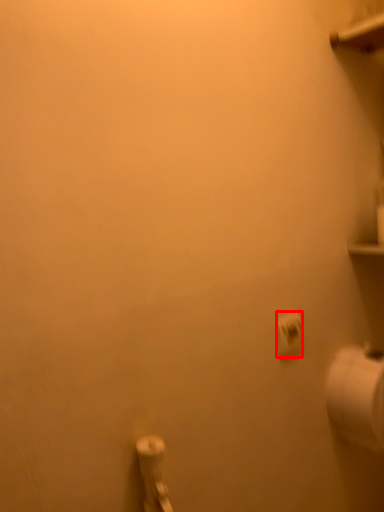
Question: From the image's perspective, where is toilet paper (annotated by the red box) located relative to toilet paper?

Choices:
 (A) below
 (B) above

Answer: (B)